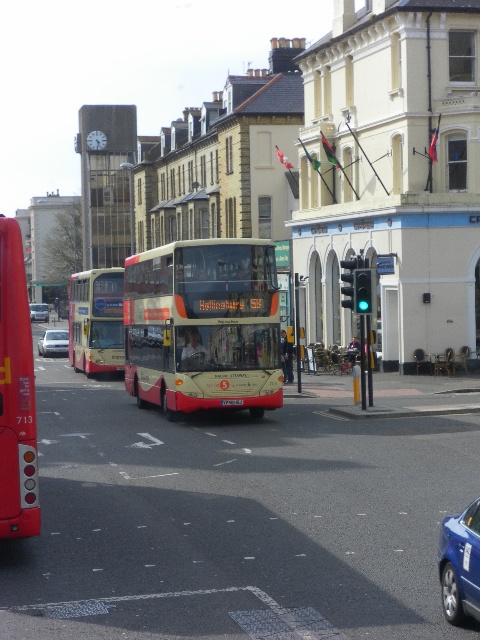
You are standing at the bus stop and want to take a photo of the bus. The bus has two points marked at coordinates point (180, 268) and point (49, 342). Which point will appear larger in your photo?

Point (180, 268) will appear larger in the photo because it is closer to the camera than point (49, 342).

You are a pedestrian standing at the crosswalk and see the beige metallic bus at center and the matte red bus at left. Which bus is closer to you?

The beige metallic bus at center is closer to you because it is further to the viewer than the matte red bus at left.

You are a pedestrian standing at the edge of the street. You see the beige metallic bus at center and the silver metallic sedan at center. If you want to cross the street safely, which vehicle should you wait for first to pass before proceeding?

The beige metallic bus at center is closer to you than the silver metallic sedan at center, so you should wait for the beige metallic bus at center to pass first before proceeding.